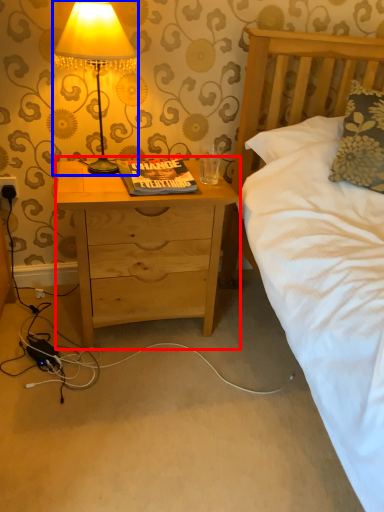
Question: Which of the following is the closest to the observer, nightstand (highlighted by a red box) or lamp (highlighted by a blue box)?

Choices:
 (A) nightstand
 (B) lamp

Answer: (B)